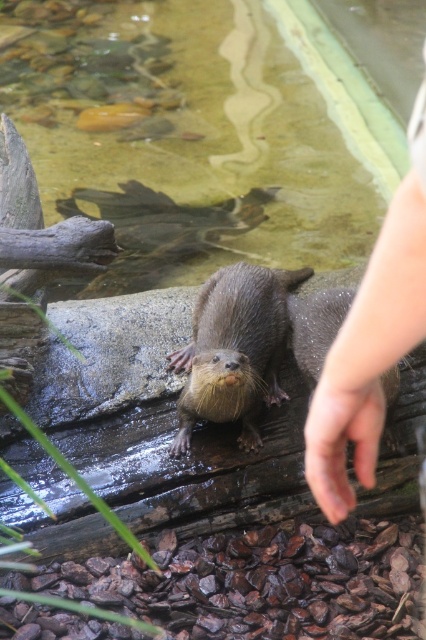
You are a zookeeper trying to feed the brown furry otter at center. There is a human hand, labeled as skinny flesh at upper right, reaching out to the otter. Which direction should you move the food to avoid the hand?

The skinny flesh at upper right is to the right of the brown furry otter at center. To avoid the hand, move the food to the left side of the brown furry otter at center.

You are a zookeeper observing an otter exhibit. You see the brown furry otter at center and the skinny flesh at center. Which object is closer to you?

The brown furry otter at center is closer to you than the skinny flesh at center.